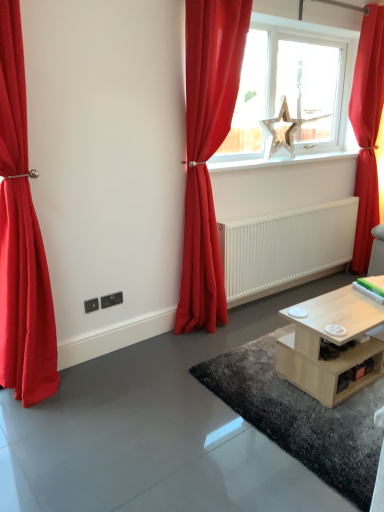
At what (x,y) coordinates should I click in order to perform the action: click on white glossy radiator at center. Please return your answer as a coordinate pair (x, y). Looking at the image, I should click on (278, 161).

Describe the element at coordinates (21, 238) in the screenshot. I see `matte red curtain at left, the 3th curtain from the right` at that location.

What is the approximate height of white smooth radiator at center?

It is 24.84 inches.

Image resolution: width=384 pixels, height=512 pixels. Describe the element at coordinates (332, 342) in the screenshot. I see `light wood/woodenobject at lower right` at that location.

Measure the distance between point (256, 121) and camera.

They are 3.21 meters apart.

This screenshot has height=512, width=384. What do you see at coordinates (207, 150) in the screenshot?
I see `matte red curtain at center, the 2th curtain in the left-to-right sequence` at bounding box center [207, 150].

Identify the location of white glossy radiator at center. pos(278,161).

Is matte red curtain at left, the 3th curtain from the right, oriented away from shiny wooden coffee table at lower center?

No, matte red curtain at left, the 3th curtain from the right, is not facing the opposite direction of shiny wooden coffee table at lower center.

Consider the image. From a real-world perspective, between matte red curtain at left, the 3th curtain from the right, and shiny wooden coffee table at lower center, who is vertically higher?

matte red curtain at left, the 3th curtain from the right, is physically above.

From the image's perspective, is matte red curtain at left, the first curtain positioned from the left, located beneath shiny wooden coffee table at lower center?

Incorrect, from the image's perspective, matte red curtain at left, the first curtain positioned from the left, is higher than shiny wooden coffee table at lower center.

Which object is further away from the camera taking this photo, matte red curtain at left, the first curtain positioned from the left, or shiny wooden coffee table at lower center?

shiny wooden coffee table at lower center is behind.

Is point (194, 127) closer to camera compared to point (236, 272)?

Yes, it is.

How many degrees apart are the facing directions of matte red curtain at center, which is the 2th curtain in right-to-left order, and white smooth radiator at center?

They differ by 1.96 degrees in their facing directions.

Would you say matte red curtain at center, the 2th curtain in the left-to-right sequence, is to the left or to the right of white smooth radiator at center in the picture?

matte red curtain at center, the 2th curtain in the left-to-right sequence, is to the left of white smooth radiator at center.

From the image's perspective, would you say matte red curtain at center, which is the 2th curtain in right-to-left order, is positioned over white smooth radiator at center?

Yes.

Who is smaller, light wood/woodenobject at lower right or matte red curtain at left, the 3th curtain from the right?

With smaller size is light wood/woodenobject at lower right.

Can we say light wood/woodenobject at lower right lies outside matte red curtain at left, the first curtain positioned from the left?

Yes, light wood/woodenobject at lower right is located beyond the bounds of matte red curtain at left, the first curtain positioned from the left.

From a real-world perspective, is matte red curtain at center, the 2th curtain in the left-to-right sequence, positioned above or below white glossy radiator at center?

Clearly, from a real-world perspective, matte red curtain at center, the 2th curtain in the left-to-right sequence, is below white glossy radiator at center.

Can you confirm if matte red curtain at center, the 2th curtain in the left-to-right sequence, is smaller than white glossy radiator at center?

Incorrect, matte red curtain at center, the 2th curtain in the left-to-right sequence, is not smaller in size than white glossy radiator at center.

Which is in front, matte red curtain at center, the 2th curtain in the left-to-right sequence, or white glossy radiator at center?

matte red curtain at center, the 2th curtain in the left-to-right sequence, is more forward.

Can you confirm if white glossy radiator at center is thinner than shiny wooden coffee table at lower center?

Yes, white glossy radiator at center is thinner than shiny wooden coffee table at lower center.

Is white glossy radiator at center surrounding shiny wooden coffee table at lower center?

Actually, shiny wooden coffee table at lower center is outside white glossy radiator at center.

Consider the image. Is white glossy radiator at center aimed at shiny wooden coffee table at lower center?

No, white glossy radiator at center is not aimed at shiny wooden coffee table at lower center.

You are a GUI agent. You are given a task and a screenshot of the screen. Output one action in this format:
    pyautogui.click(x=<x>, y=<y>)
    Task: Click on the window sill lying above the shiny wooden coffee table at lower center (from the image's perspective)
    
    Given the screenshot: What is the action you would take?
    pyautogui.click(x=278, y=161)

Does shiny wooden coffee table at lower center have a smaller size compared to red velvet curtain at right, arranged as the 3th curtain when viewed from the left?

Yes, shiny wooden coffee table at lower center is smaller than red velvet curtain at right, arranged as the 3th curtain when viewed from the left.

Where is `plain in front of the red velvet curtain at right, arranged as the 3th curtain when viewed from the left`? plain in front of the red velvet curtain at right, arranged as the 3th curtain when viewed from the left is located at coordinates (301, 417).

Is shiny wooden coffee table at lower center next to red velvet curtain at right, arranged as the 3th curtain when viewed from the left, and touching it?

No, shiny wooden coffee table at lower center is not making contact with red velvet curtain at right, arranged as the 3th curtain when viewed from the left.

Is red velvet curtain at right, arranged as the 3th curtain when viewed from the left, bigger than shiny wooden coffee table at lower center?

Indeed, red velvet curtain at right, arranged as the 3th curtain when viewed from the left, has a larger size compared to shiny wooden coffee table at lower center.

Is red velvet curtain at right, placed as the 1th curtain when sorted from right to left, aimed at shiny wooden coffee table at lower center?

No, red velvet curtain at right, placed as the 1th curtain when sorted from right to left, is not turned towards shiny wooden coffee table at lower center.

From a real-world perspective, does red velvet curtain at right, placed as the 1th curtain when sorted from right to left, sit lower than shiny wooden coffee table at lower center?

Actually, red velvet curtain at right, placed as the 1th curtain when sorted from right to left, is physically above shiny wooden coffee table at lower center in the real world.

Consider the image. Is shiny wooden coffee table at lower center located within red velvet curtain at right, placed as the 1th curtain when sorted from right to left?

Definitely not — shiny wooden coffee table at lower center is not inside red velvet curtain at right, placed as the 1th curtain when sorted from right to left.

Image resolution: width=384 pixels, height=512 pixels. Identify the location of curtain that appears in front of the shiny wooden coffee table at lower center. (21, 238).

From the image's perspective, count 2nd curtains upward from the white smooth radiator at center and point to it. Please provide its 2D coordinates.

[(207, 150)]

Looking at the image, which one is located further to matte red curtain at center, the 2th curtain in the left-to-right sequence, matte red curtain at left, the 3th curtain from the right, or white smooth radiator at center?

Among the two, matte red curtain at left, the 3th curtain from the right, is located further to matte red curtain at center, the 2th curtain in the left-to-right sequence.

Based on their spatial positions, is wooden star at center or shiny wooden coffee table at lower center further from white glossy radiator at center?

shiny wooden coffee table at lower center lies further to white glossy radiator at center than the other object.

Considering their positions, is white glossy radiator at center positioned further to shiny wooden coffee table at lower center than wooden star at center?

wooden star at center is positioned further to the anchor shiny wooden coffee table at lower center.

Considering their positions, is wooden star at center positioned further to light wood/woodenobject at lower right than white smooth radiator at center?

wooden star at center is positioned further to the anchor light wood/woodenobject at lower right.

Estimate the real-world distances between objects in this image. Which object is closer to red velvet curtain at right, placed as the 1th curtain when sorted from right to left, matte red curtain at center, the 2th curtain in the left-to-right sequence, or shiny wooden coffee table at lower center?

matte red curtain at center, the 2th curtain in the left-to-right sequence, is positioned closer to the anchor red velvet curtain at right, placed as the 1th curtain when sorted from right to left.

When comparing their distances from red velvet curtain at right, arranged as the 3th curtain when viewed from the left, does matte red curtain at center, which is the 2th curtain in right-to-left order, or white smooth radiator at center seem closer?

white smooth radiator at center.

Looking at the image, which one is located closer to matte red curtain at center, the 2th curtain in the left-to-right sequence, red velvet curtain at right, arranged as the 3th curtain when viewed from the left, or wooden star at center?

wooden star at center is closer to matte red curtain at center, the 2th curtain in the left-to-right sequence.

From the image, which object appears to be nearer to wooden star at center, white glossy radiator at center or matte red curtain at center, the 2th curtain in the left-to-right sequence?

white glossy radiator at center is positioned closer to the anchor wooden star at center.

Locate an element on the screen. radiator between white glossy radiator at center and red velvet curtain at right, placed as the 1th curtain when sorted from right to left, in the horizontal direction is located at coordinates (286, 249).

Identify the location of table between matte red curtain at left, the first curtain positioned from the left, and red velvet curtain at right, placed as the 1th curtain when sorted from right to left, in the horizontal direction. Image resolution: width=384 pixels, height=512 pixels. (332, 342).

Where is `table that lies between matte red curtain at center, which is the 2th curtain in right-to-left order, and shiny wooden coffee table at lower center from top to bottom`? The width and height of the screenshot is (384, 512). table that lies between matte red curtain at center, which is the 2th curtain in right-to-left order, and shiny wooden coffee table at lower center from top to bottom is located at coordinates (332, 342).

Identify the location of radiator between matte red curtain at center, the 2th curtain in the left-to-right sequence, and red velvet curtain at right, arranged as the 3th curtain when viewed from the left, in the horizontal direction. (286, 249).